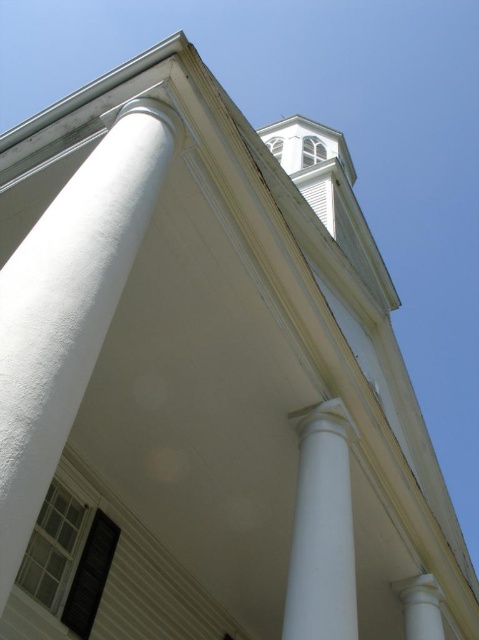
Is point (318, 420) closer to viewer compared to point (405, 605)?

That is True.

Is white smooth column at center in front of white smooth column at lower right?

That is True.

Find the location of a particular element. This screenshot has height=640, width=479. white smooth column at center is located at coordinates (321, 529).

Where is `white smooth column at center`? This screenshot has height=640, width=479. white smooth column at center is located at coordinates (321, 529).

Does white smooth column at left have a lesser width compared to white smooth column at center?

Correct, white smooth column at left's width is less than white smooth column at center's.

Who is shorter, white smooth column at left or white smooth column at center?

With less height is white smooth column at left.

Locate an element on the screen. white smooth column at left is located at coordinates (68, 308).

I want to click on white smooth column at left, so click(x=68, y=308).

Is white smooth column at left smaller than white smooth column at lower right?

Correct, white smooth column at left occupies less space than white smooth column at lower right.

Can you confirm if white smooth column at left is thinner than white smooth column at lower right?

Correct, white smooth column at left's width is less than white smooth column at lower right's.

Which is in front, point (129, 134) or point (422, 621)?

Positioned in front is point (129, 134).

This screenshot has width=479, height=640. I want to click on white smooth column at left, so click(x=68, y=308).